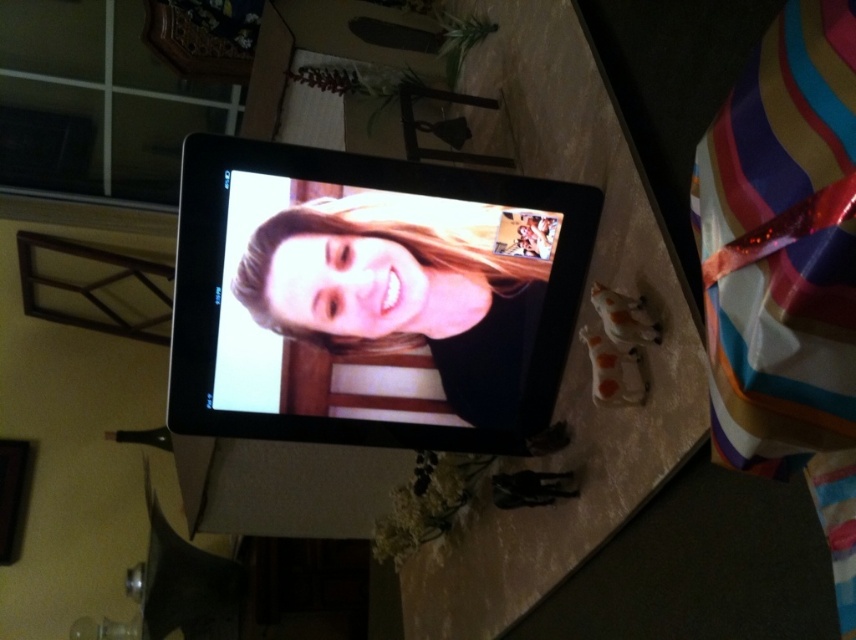
Question: Does matte black screen at center have a lesser width compared to matte skin face at center?

Choices:
 (A) yes
 (B) no

Answer: (B)

Question: Can you confirm if matte black screen at center is positioned to the left of matte skin face at center?

Choices:
 (A) yes
 (B) no

Answer: (B)

Question: Which object appears farthest from the camera in this image?

Choices:
 (A) matte black screen at center
 (B) matte skin face at center

Answer: (B)

Question: In this image, where is matte black screen at center located relative to matte skin face at center?

Choices:
 (A) right
 (B) left

Answer: (A)